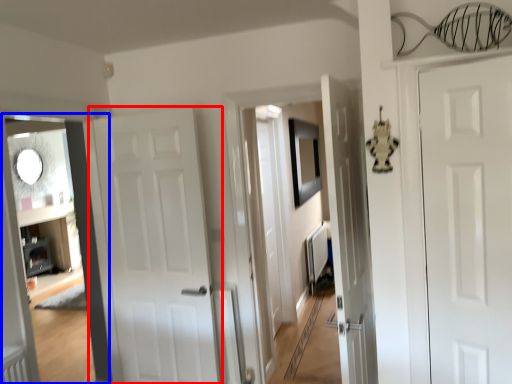
Question: Which object is further to the camera taking this photo, door (highlighted by a red box) or corridor (highlighted by a blue box)?

Choices:
 (A) door
 (B) corridor

Answer: (A)